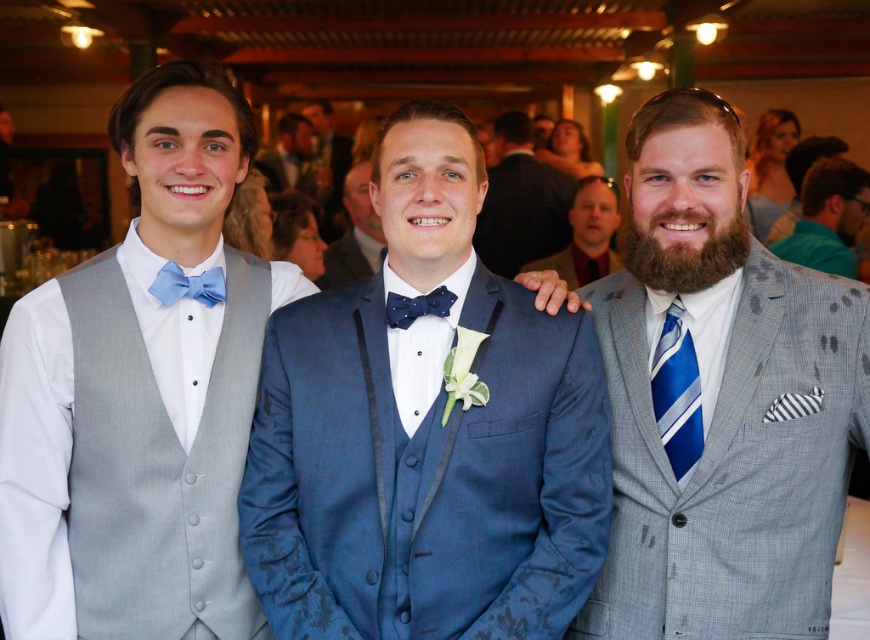
You are a photographer adjusting your camera settings to focus on the subjects. Since you want to capture both the matte blue bow tie at left and the blue textured suit at center clearly, which one should you focus on first to ensure the foreground is sharp?

You should focus on the matte blue bow tie at left first because it is closer to the viewer than the blue textured suit at center, ensuring the foreground is sharp before adjusting for the background.

You are a photographer at a wedding reception and need to ensure that all guests are visible in the group photo. You notice the blue striped tie at right and the blue textured suit at center. Which of these items takes up more space in the photo?

The blue textured suit at center occupies more space than the blue striped tie at right, so it takes up more space in the photo.

You are standing at the center of the image and want to move towards the two points marked in the scene. Which point, point (x=216, y=300) or point (x=589, y=259), is closer to you?

Point (x=216, y=300) is in front of point (x=589, y=259), so it is closer to you.